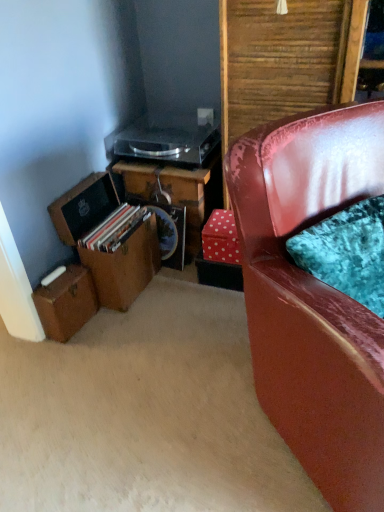
Question: In terms of size, does transparent plastic record player at upper center appear bigger or smaller than brown leather suitcase at lower left, which ranks as the 1th box in bottom-to-top order?

Choices:
 (A) big
 (B) small

Answer: (A)

Question: From a real-world perspective, is transparent plastic record player at upper center positioned above or below brown leather suitcase at lower left, which appears as the 2th box when viewed from the top?

Choices:
 (A) below
 (B) above

Answer: (B)

Question: Which of these objects is positioned closest to the brown leather suitcase at lower left, the second box from the bottom?

Choices:
 (A) shiny red leather chair at right
 (B) wooden desk at center
 (C) red polka dot cardboard box at lower right
 (D) brown leather suitcase at lower left, which ranks as the 1th box in bottom-to-top order
 (E) transparent plastic record player at upper center

Answer: (D)

Question: Which is nearer to the shiny red leather chair at right?

Choices:
 (A) brown leather suitcase at lower left, the second box from the bottom
 (B) wooden desk at center
 (C) brown leather suitcase at lower left, which appears as the 2th box when viewed from the top
 (D) transparent plastic record player at upper center
 (E) red polka dot cardboard box at lower right

Answer: (E)